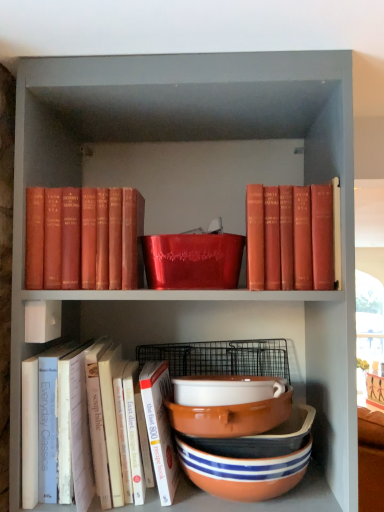
Question: Is striped ceramic bowls at lower center, which appears as the second bowl when viewed from the top, taller than matte red book at upper right, which ranks as the third book in left-to-right order?

Choices:
 (A) no
 (B) yes

Answer: (A)

Question: Is striped ceramic bowls at lower center, which appears as the second bowl when viewed from the top, to the left of matte red book at upper right, acting as the third book starting from the bottom, from the viewer's perspective?

Choices:
 (A) no
 (B) yes

Answer: (B)

Question: Is striped ceramic bowls at lower center, which appears as the second bowl when viewed from the top, looking in the opposite direction of matte red book at upper right, which ranks as the third book in left-to-right order?

Choices:
 (A) yes
 (B) no

Answer: (B)

Question: Are striped ceramic bowls at lower center, which is the second bowl from bottom to top, and matte red book at upper right, acting as the third book starting from the bottom, making contact?

Choices:
 (A) no
 (B) yes

Answer: (A)

Question: From the image's perspective, is striped ceramic bowls at lower center, which is the second bowl from bottom to top, beneath matte red book at upper right, acting as the third book starting from the bottom?

Choices:
 (A) no
 (B) yes

Answer: (B)

Question: Is striped ceramic bowls at lower center, which appears as the second bowl when viewed from the top, wider than matte red book at upper right, the first book viewed from the top?

Choices:
 (A) yes
 (B) no

Answer: (B)

Question: From a real-world perspective, is white ceramic bowl at center, which is counted as the 1th bowl, starting from the top, on white paper book at lower left, which ranks as the second book in left-to-right order?

Choices:
 (A) yes
 (B) no

Answer: (A)

Question: Does white ceramic bowl at center, the third bowl positioned from the bottom, appear on the right side of white paper book at lower left, placed as the 3th book when sorted from top to bottom?

Choices:
 (A) no
 (B) yes

Answer: (B)

Question: Can white paper book at lower left, placed as the 3th book when sorted from top to bottom, be found inside white ceramic bowl at center, which is counted as the 1th bowl, starting from the top?

Choices:
 (A) no
 (B) yes

Answer: (A)

Question: From the image's perspective, is white ceramic bowl at center, which is counted as the 1th bowl, starting from the top, on top of white paper book at lower left, which appears as the 2th book when viewed from the right?

Choices:
 (A) yes
 (B) no

Answer: (A)

Question: Are white ceramic bowl at center, which is counted as the 1th bowl, starting from the top, and white paper book at lower left, placed as the 3th book when sorted from top to bottom, making contact?

Choices:
 (A) yes
 (B) no

Answer: (B)

Question: Is white ceramic bowl at center, which is counted as the 1th bowl, starting from the top, shorter than white paper book at lower left, which ranks as the second book in left-to-right order?

Choices:
 (A) yes
 (B) no

Answer: (A)

Question: Could striped ceramic bowls at lower center, which appears as the second bowl when viewed from the top, be considered to be inside white paper book at lower left, placed as the 3th book when sorted from top to bottom?

Choices:
 (A) yes
 (B) no

Answer: (B)